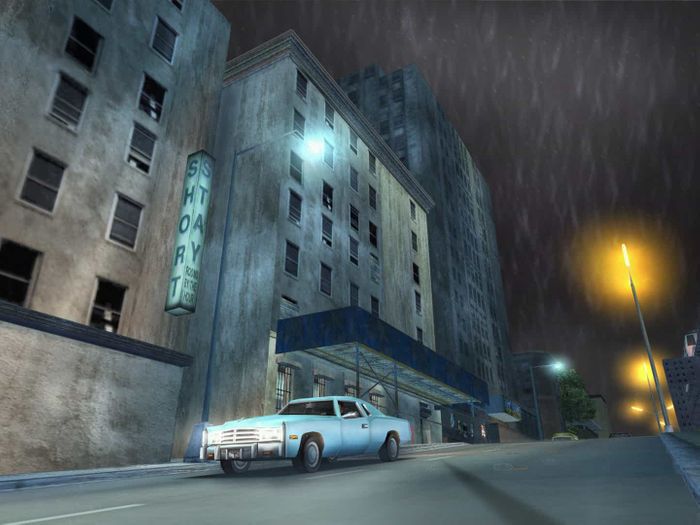
At what (x,y) coordinates should I click in order to perform the action: click on window grill. Please return your answer as a coordinate pair (x, y). The image size is (700, 525). Looking at the image, I should click on (315, 386), (349, 392), (379, 400).